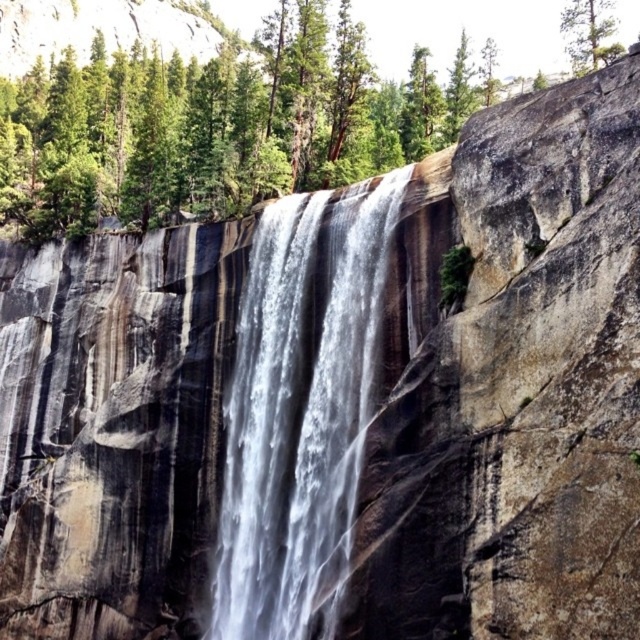
Question: Estimate the real-world distances between objects in this image. Which object is closer to the white smooth waterfall at center?

Choices:
 (A) green matte tree at upper center
 (B) green leafy tree at center

Answer: (A)

Question: Among these objects, which one is nearest to the camera?

Choices:
 (A) green leafy tree at center
 (B) white smooth waterfall at center

Answer: (B)

Question: Which object is positioned farthest from the green matte tree at upper center?

Choices:
 (A) white smooth waterfall at center
 (B) green leafy tree at center

Answer: (B)

Question: Is green leafy tree at center to the left of white smooth waterfall at center from the viewer's perspective?

Choices:
 (A) no
 (B) yes

Answer: (A)

Question: Is white smooth waterfall at center thinner than green matte tree at upper center?

Choices:
 (A) no
 (B) yes

Answer: (B)

Question: Is white smooth waterfall at center positioned before green matte tree at upper center?

Choices:
 (A) no
 (B) yes

Answer: (B)